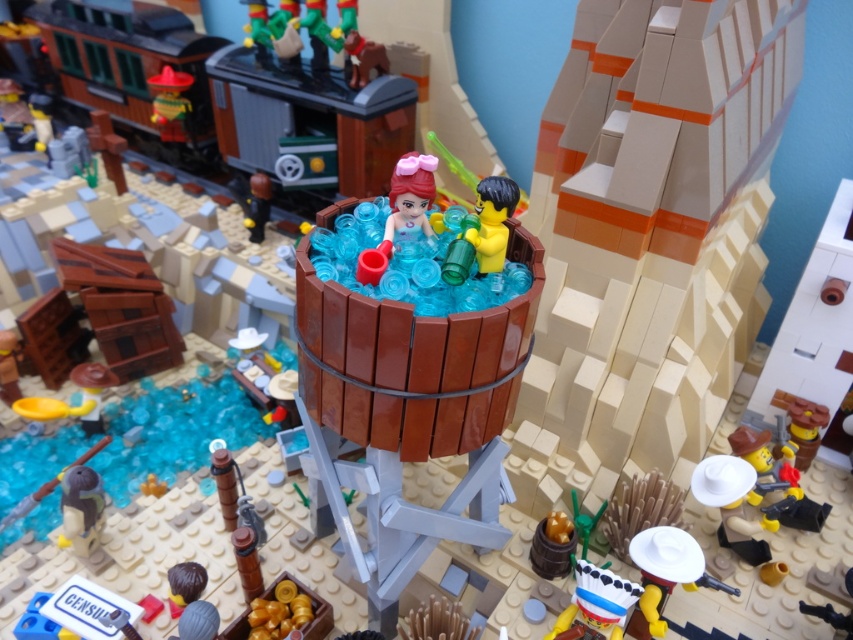
Is matte black train car at upper left to the left of yellow matte minifigure at center from the viewer's perspective?

Indeed, matte black train car at upper left is positioned on the left side of yellow matte minifigure at center.

Which is behind, point (131, 60) or point (496, 230)?

The point (131, 60) is behind.

Locate an element on the screen. matte black train car at upper left is located at coordinates (312, 116).

Does translucent pink plastic figure at center appear on the right side of yellow matte minifigure at center?

Incorrect, translucent pink plastic figure at center is not on the right side of yellow matte minifigure at center.

In the scene shown: Who is more distant from viewer, [410,193] or [482,272]?

Positioned behind is point [482,272].

At what (x,y) coordinates should I click in order to perform the action: click on translucent pink plastic figure at center. Please return your answer as a coordinate pair (x, y). This screenshot has width=853, height=640. Looking at the image, I should click on (409, 198).

Measure the distance from wooden barrel at center to yellow matte minifigure at center.

wooden barrel at center is 12.18 inches away from yellow matte minifigure at center.

Who is shorter, wooden barrel at center or yellow matte minifigure at center?

With less height is yellow matte minifigure at center.

Describe the element at coordinates (408, 374) in the screenshot. The height and width of the screenshot is (640, 853). I see `wooden barrel at center` at that location.

Image resolution: width=853 pixels, height=640 pixels. Identify the location of wooden barrel at center. (408, 374).